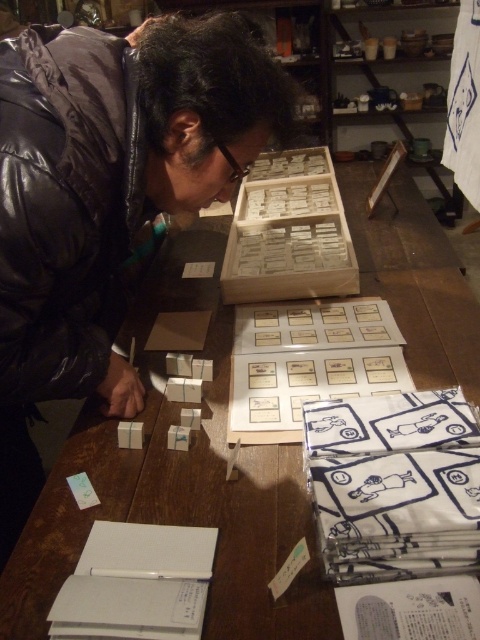
Between matte black jacket at center and wooden box at upper center, which one appears on the left side from the viewer's perspective?

From the viewer's perspective, matte black jacket at center appears more on the left side.

Is matte black jacket at center thinner than wooden box at upper center?

Incorrect, matte black jacket at center's width is not less than wooden box at upper center's.

Locate an element on the screen. matte black jacket at center is located at coordinates (107, 198).

Does matte black jacket at center have a smaller size compared to transparent plastic glasses at center?

Incorrect, matte black jacket at center is not smaller in size than transparent plastic glasses at center.

Does point (128, 52) come in front of point (223, 156)?

That is True.

The height and width of the screenshot is (640, 480). Identify the location of matte black jacket at center. (107, 198).

Is wooden box at upper center to the left of transparent plastic glasses at center from the viewer's perspective?

In fact, wooden box at upper center is to the right of transparent plastic glasses at center.

Is point (298, 150) positioned after point (218, 140)?

Yes, point (298, 150) is behind point (218, 140).

Is point (311, 272) closer to camera compared to point (223, 147)?

No, it is behind (223, 147).

Find the location of `wooden box at upper center`. wooden box at upper center is located at coordinates (288, 232).